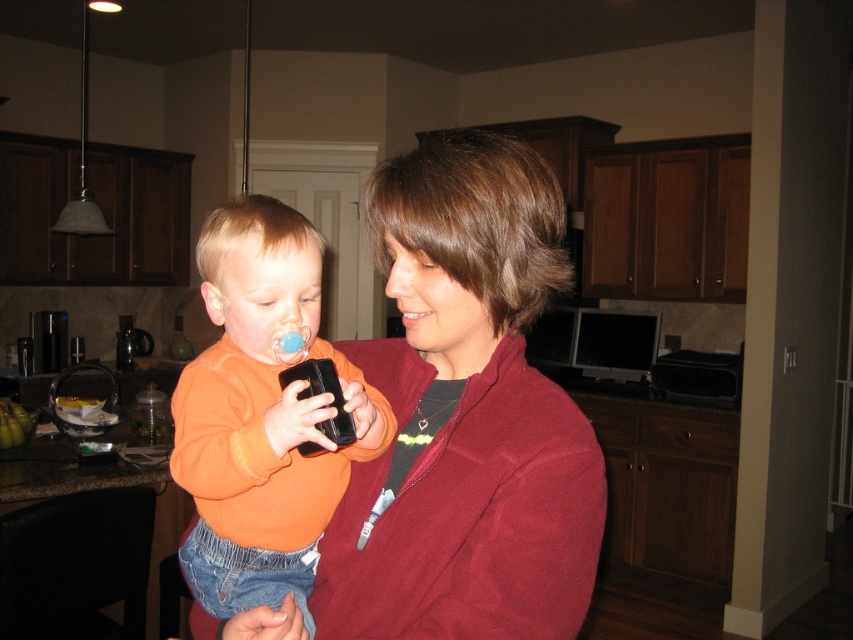
You are standing in the kitchen and need to place a small item on the counter near the maroon fleece jacket at center. Where should you place it?

The maroon fleece jacket at center is located at point (465, 413), so you should place the item near those coordinates on the counter.